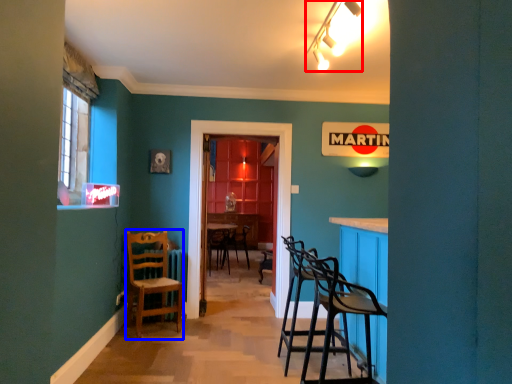
Question: Which object appears farthest to the camera in this image, lamp (highlighted by a red box) or chair (highlighted by a blue box)?

Choices:
 (A) lamp
 (B) chair

Answer: (B)